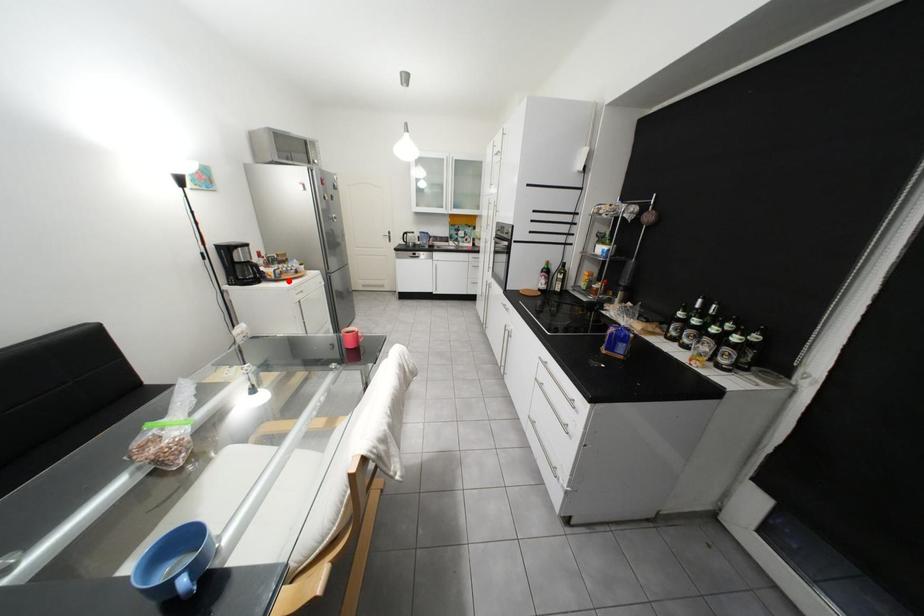
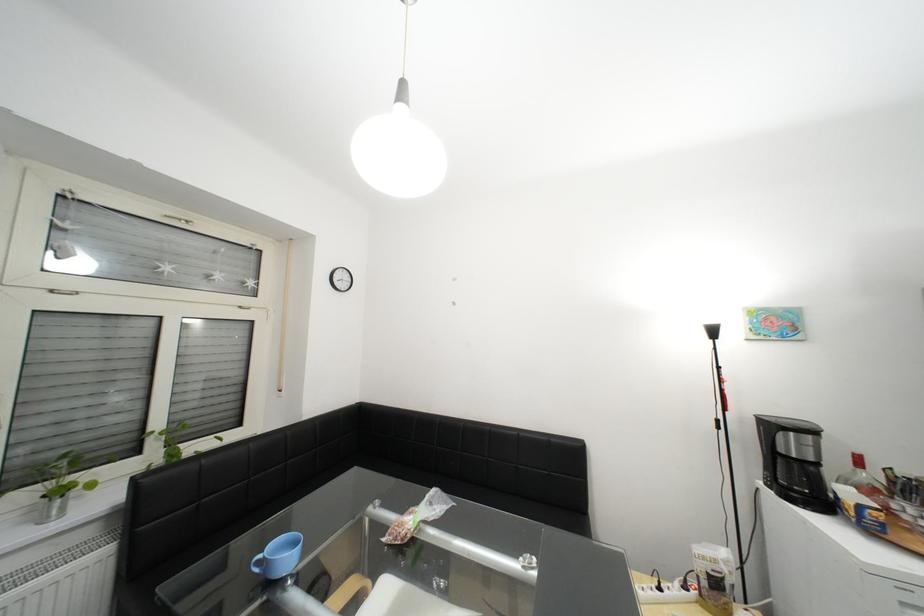
Question: I am providing you with two images of the same scene from different viewpoints. A red point is marked on the first image. Can you still see the location of the red point in image 2?

Choices:
 (A) Yes
 (B) No

Answer: (A)